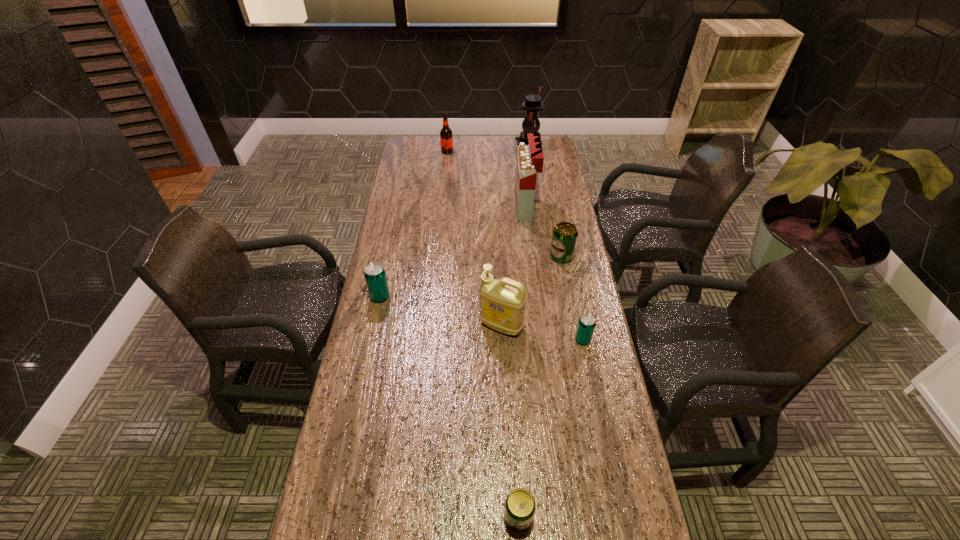
The height and width of the screenshot is (540, 960). In order to click on free spot located 0.250m with the lid open on the red cigarette case in this screenshot , I will do [x=456, y=208].

The image size is (960, 540). In order to click on free space located 0.280m on the left of the third tallest object in this screenshot , I will do `click(392, 326)`.

Locate an element on the screen. The width and height of the screenshot is (960, 540). vacant region located on the front of the second object from left to right is located at coordinates (444, 176).

This screenshot has width=960, height=540. What are the coordinates of `vacant space located 0.070m on the back of the farthest beer can` in the screenshot? It's located at (558, 236).

At what (x,y) coordinates should I click in order to perform the action: click on vacant space situated on the back of the leftmost object. Please return your answer as a coordinate pair (x, y). The width and height of the screenshot is (960, 540). Looking at the image, I should click on (394, 231).

Image resolution: width=960 pixels, height=540 pixels. In order to click on free region located 0.300m on the left of the nearest object in this screenshot , I will do `click(374, 517)`.

Identify the location of free location located on the front of the smaller teal beer can. The height and width of the screenshot is (540, 960). (606, 457).

At what (x,y) coordinates should I click in order to perform the action: click on lantern that is at the far edge. Please return your answer as a coordinate pair (x, y). Looking at the image, I should click on (532, 104).

Where is `root beer present at the far edge`? This screenshot has width=960, height=540. root beer present at the far edge is located at coordinates (x=446, y=136).

Identify the location of object at the left edge. (375, 276).